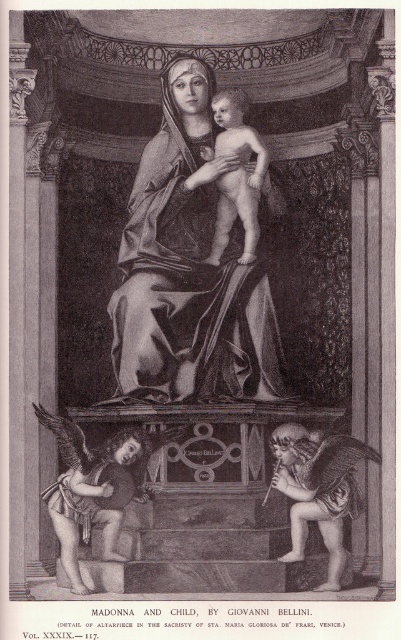
Question: Which point is farther from the camera taking this photo?

Choices:
 (A) (259, 227)
 (B) (178, 136)

Answer: (A)

Question: Which of the following is the closest to the observer?

Choices:
 (A) smooth gray fabric at center
 (B) smooth flesh baby at center

Answer: (A)

Question: Which point is farther to the camera?

Choices:
 (A) (157, 257)
 (B) (220, 212)

Answer: (B)

Question: From the image, what is the correct spatial relationship of smooth gray fabric at center in relation to smooth flesh baby at center?

Choices:
 (A) below
 (B) above

Answer: (A)

Question: Considering the relative positions of smooth gray fabric at center and smooth flesh baby at center in the image provided, where is smooth gray fabric at center located with respect to smooth flesh baby at center?

Choices:
 (A) below
 (B) above

Answer: (A)

Question: Can you confirm if smooth gray fabric at center is thinner than smooth flesh baby at center?

Choices:
 (A) yes
 (B) no

Answer: (B)